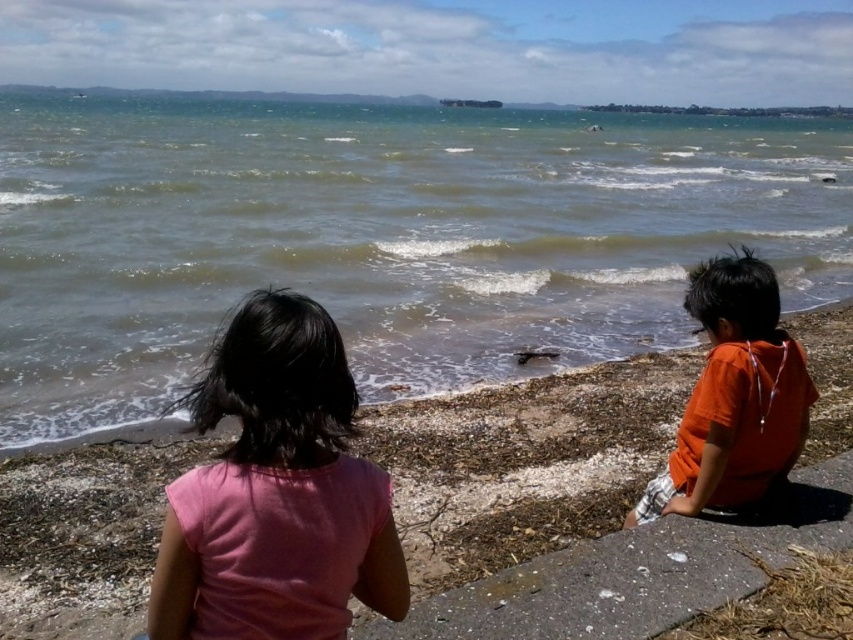
You are standing at the edge of the beach and want to walk to the white concrete stone at lower right without stepping into the blue water at center. Which direction should you move from your current position?

You should move to the right because the white concrete stone at lower right is located to the right of the blue water at center, so moving right will avoid stepping into the water.

From the picture: You are standing on the beach and want to walk from the orange cotton shirt at right to the blue water at center. Which direction should you move?

You should move to the left because the blue water at center is to the left of the orange cotton shirt at right.

You are a photographer trying to capture the children on the beach. If you focus on the blue water at center, will the pink fabric shirt at center be in focus as well?

The pink fabric shirt at center is behind the blue water at center, so if you focus on the blue water at center, the pink fabric shirt at center will likely be out of focus due to the distance between them.